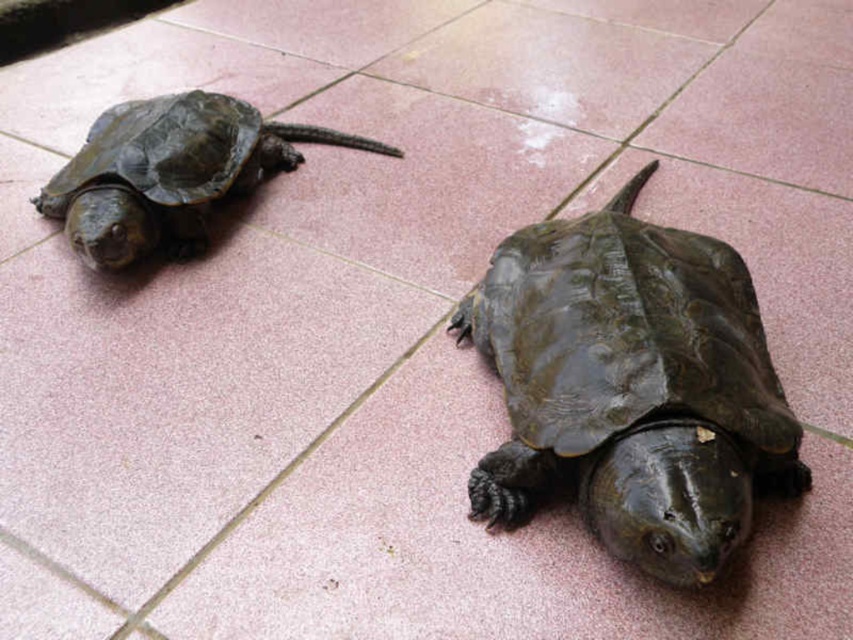
Question: Which point appears closest to the camera in this image?

Choices:
 (A) (244, 140)
 (B) (683, 465)

Answer: (B)

Question: Among these objects, which one is farthest from the camera?

Choices:
 (A) shiny dark green tortoise at left
 (B) shiny dark green tortoise at center

Answer: (A)

Question: Considering the relative positions of shiny dark green tortoise at center and shiny dark green tortoise at left in the image provided, where is shiny dark green tortoise at center located with respect to shiny dark green tortoise at left?

Choices:
 (A) right
 (B) left

Answer: (A)

Question: Is shiny dark green tortoise at center wider than shiny dark green tortoise at left?

Choices:
 (A) no
 (B) yes

Answer: (A)

Question: Does shiny dark green tortoise at center come in front of shiny dark green tortoise at left?

Choices:
 (A) yes
 (B) no

Answer: (A)

Question: Among these points, which one is farthest from the camera?

Choices:
 (A) (701, 266)
 (B) (47, 214)

Answer: (B)